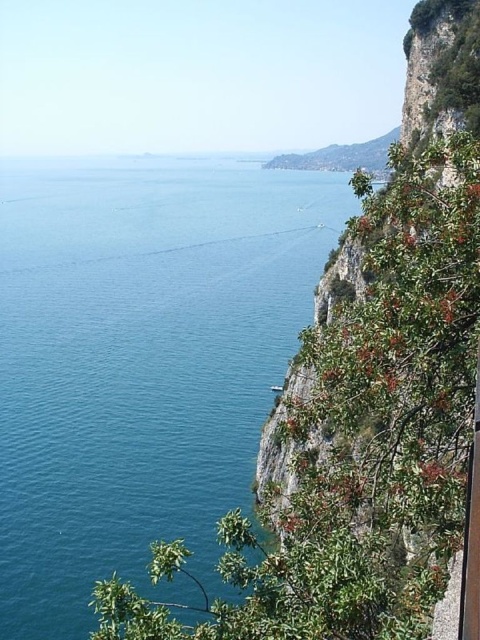
You are a drone operator who needs to fly a drone from the blue water at center to the green leafy cliff at right. The drone has a maximum flight range of 80 meters. Based on the scene, can the drone reach the cliff from the water?

The blue water at center and green leafy cliff at right are 82.93 meters apart. Since the drone can only fly 80 meters, it cannot reach the cliff from the water.

You are standing at the cliff on the right side of the image. If you want to reach the blue water at center, in which direction should you move?

You should move towards the left to reach the blue water at center since it is located on the left side of the image.